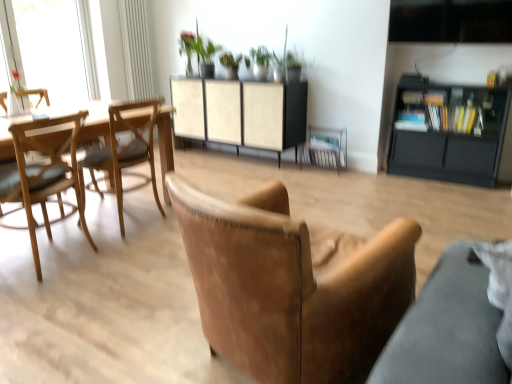
Question: From the image's perspective, is green matte plant at upper center above or below beige woven cabinet at center, marked as the 1th cabinetry in a left-to-right arrangement?

Choices:
 (A) below
 (B) above

Answer: (B)

Question: Looking at the image, does green matte plant at upper center seem bigger or smaller compared to beige woven cabinet at center, the 2th cabinetry in the right-to-left sequence?

Choices:
 (A) small
 (B) big

Answer: (A)

Question: Which object is the farthest from the green matte plant at upper center?

Choices:
 (A) black matte cabinet at right, acting as the 2th cabinetry starting from the left
 (B) beige woven cabinet at center, marked as the 1th cabinetry in a left-to-right arrangement
 (C) green leafy plant at upper center
 (D) transparent glass window at upper left
 (E) brown leather armchair at center

Answer: (D)

Question: Considering the real-world distances, which object is closest to the leather armchair at center, which is the 1th chair in right-to-left order?

Choices:
 (A) woodenmaterial/texturetable at left
 (B) light brown wooden chair at left, placed as the first chair when sorted from left to right
 (C) green matte plant at upper center
 (D) green leafy plant at upper center
 (E) brown leather armchair at center

Answer: (B)